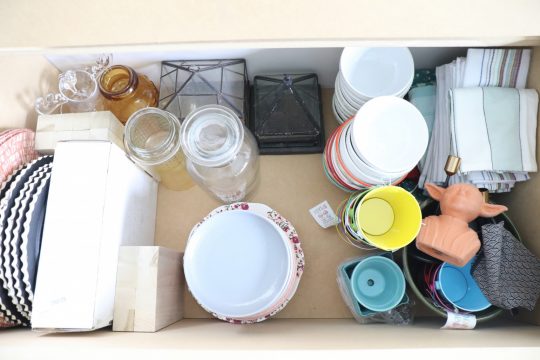
Where is `jar`? This screenshot has width=540, height=360. jar is located at coordinates (162, 161).